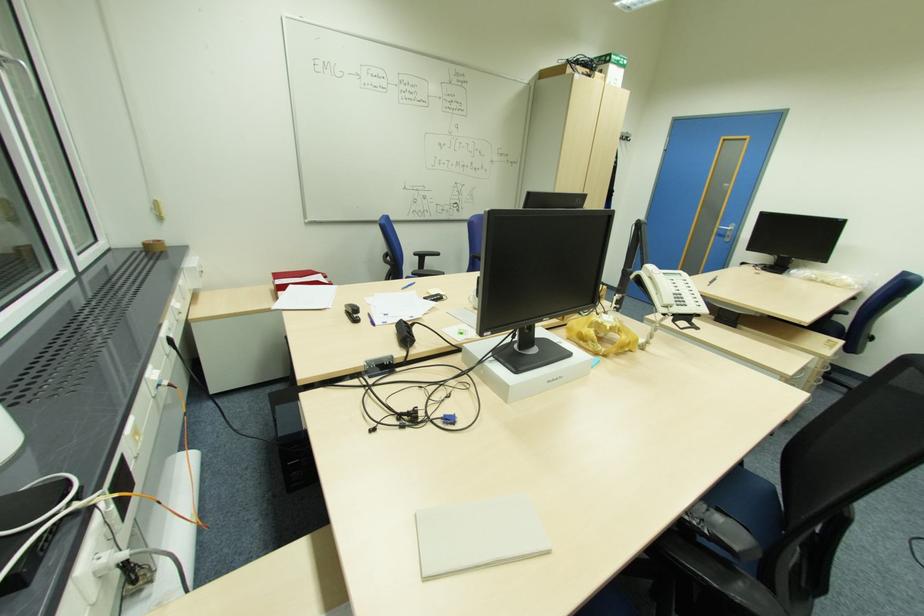
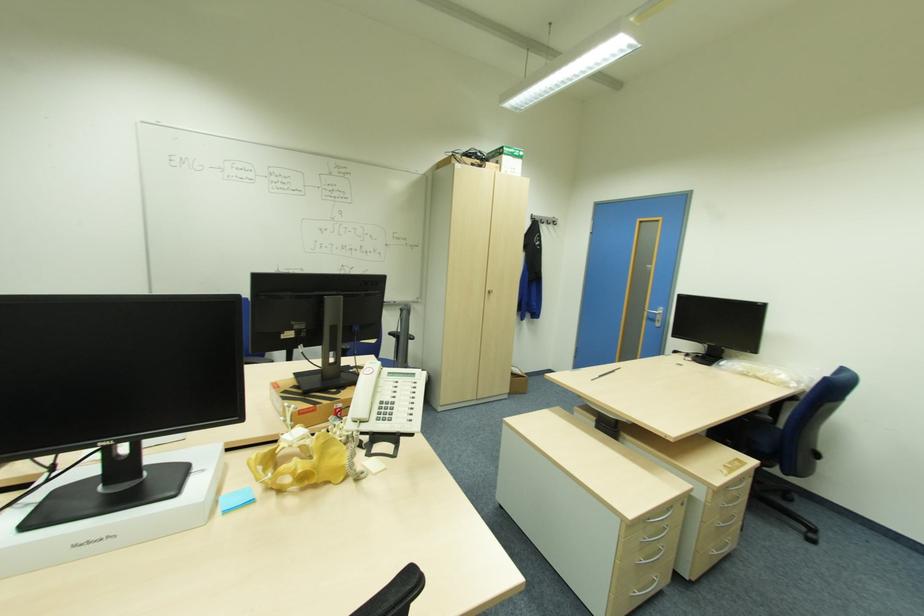
The point at (713, 281) is marked in the first image. Where is the corresponding point in the second image?

(602, 374)